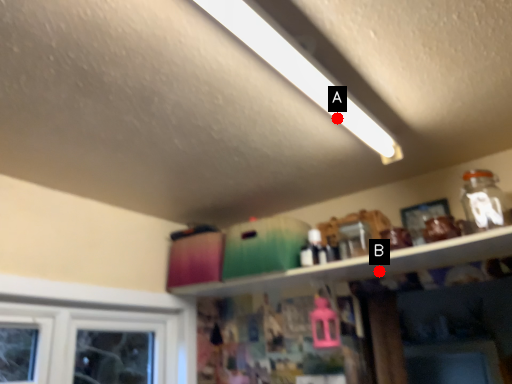
Question: Two points are circled on the image, labeled by A and B beside each circle. Which point is farther to the camera?

Choices:
 (A) A is further
 (B) B is further

Answer: (B)